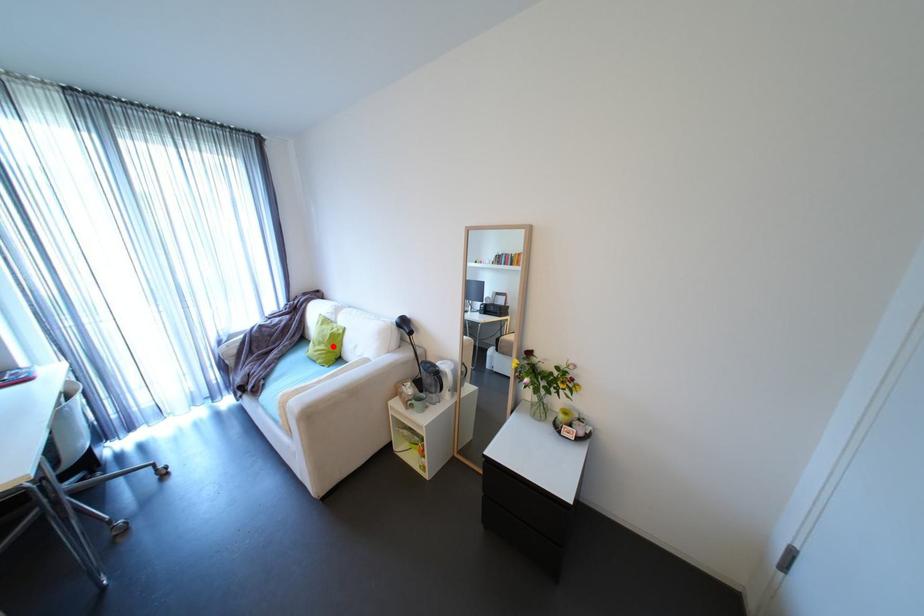
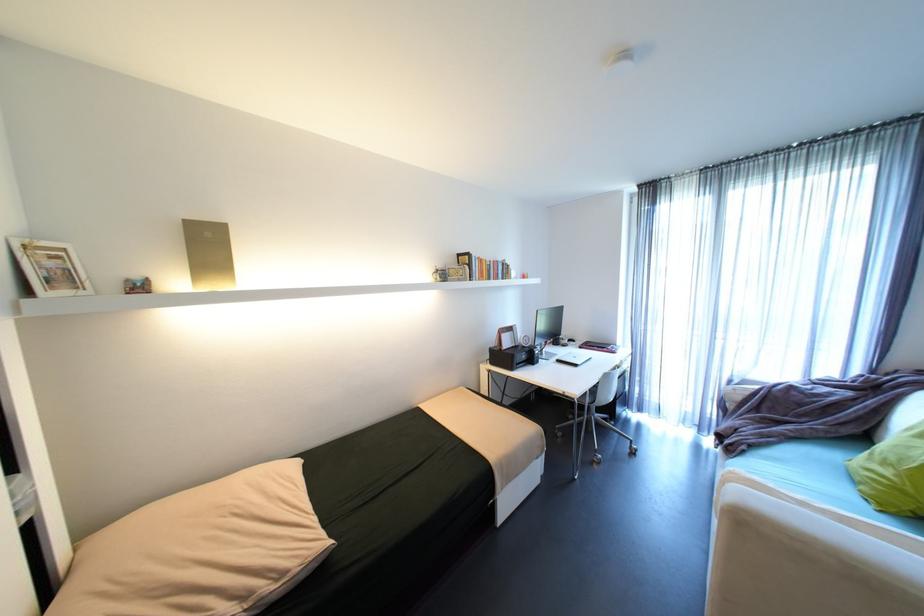
Question: I am providing you with two images of the same scene from different viewpoints. Image1 has a red point marked. In image2, the corresponding 3D location appears at what relative position? Reply with the corresponding letter.

Choices:
 (A) Closer
 (B) Farther

Answer: (B)